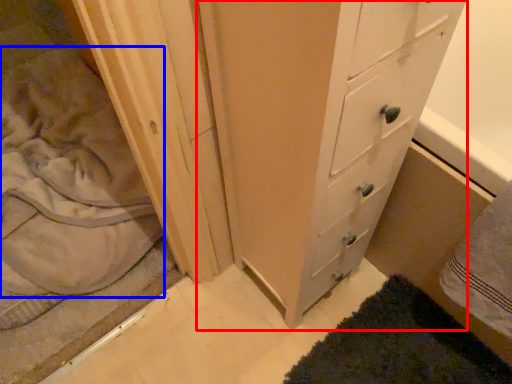
Question: Among these objects, which one is nearest to the camera, chest of drawers (highlighted by a red box) or sheet (highlighted by a blue box)?

Choices:
 (A) chest of drawers
 (B) sheet

Answer: (A)